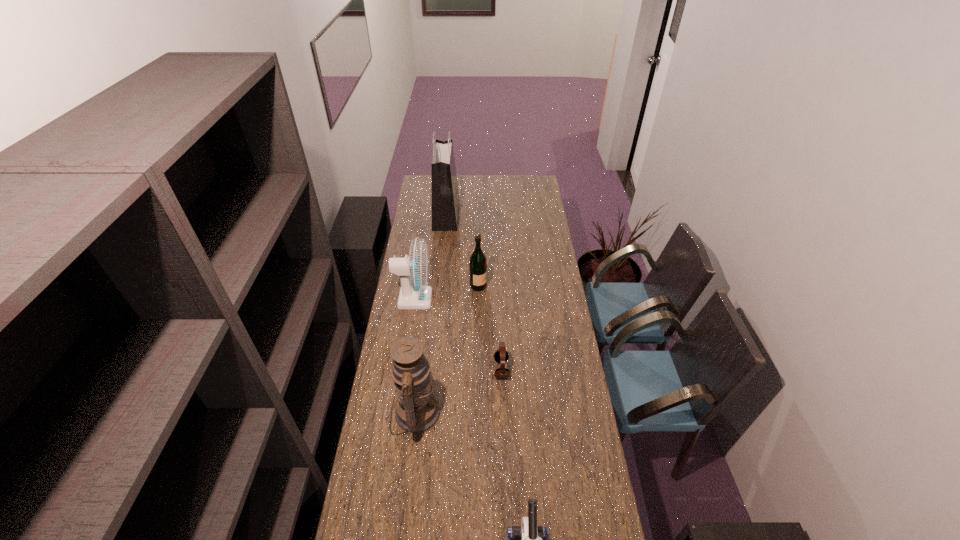
Find the location of `the farthest object`. the farthest object is located at coordinates (445, 196).

Identify the location of shopping bag. (445, 196).

In order to click on the fifth shortest object in this screenshot , I will do `click(417, 410)`.

The image size is (960, 540). Identify the location of the second nearest object. (417, 410).

Where is `fan`? Image resolution: width=960 pixels, height=540 pixels. fan is located at coordinates (414, 271).

I want to click on liquor, so click(x=478, y=264).

Identify the location of headset. The image size is (960, 540). (501, 355).

Locate an element on the screen. the fourth farthest object is located at coordinates (501, 355).

Where is `vacant area situated on the front with handles of the farthest object`? vacant area situated on the front with handles of the farthest object is located at coordinates (487, 214).

At what (x,y) coordinates should I click in order to perform the action: click on free region located on the front of the oil lamp. Please return your answer as a coordinate pair (x, y). This screenshot has width=960, height=540. Looking at the image, I should click on (409, 462).